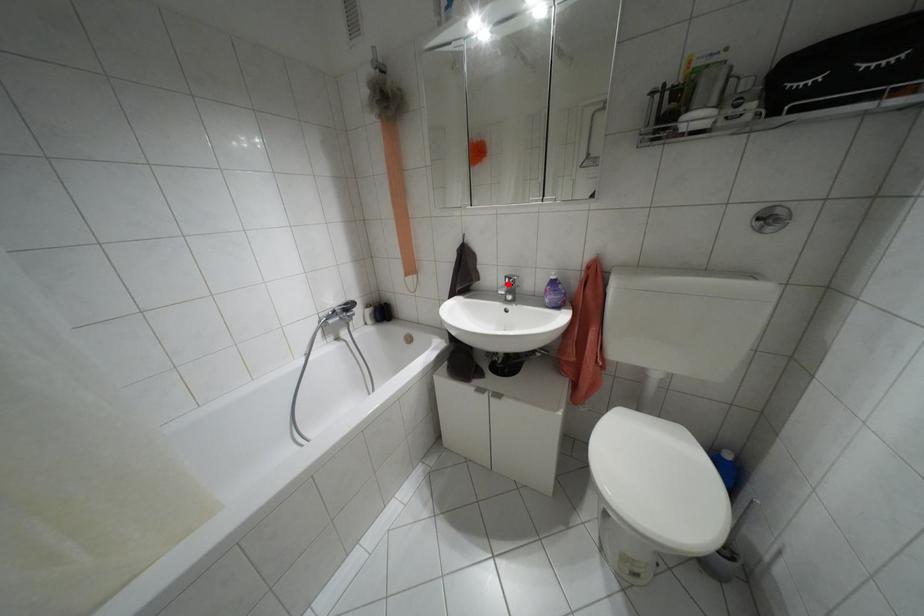
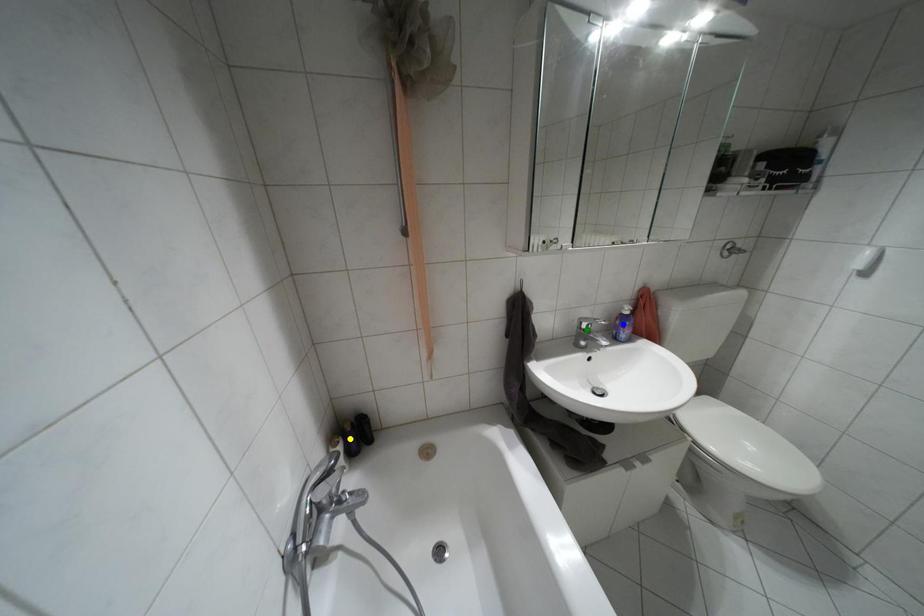
Question: I am providing you with two images of the same scene from different viewpoints. A red point is marked on the first image. You are given multiple points on the second image. Which point in image 2 is actually the same real-world point as the red point in image 1?

Choices:
 (A) yellow point
 (B) green point
 (C) blue point

Answer: (B)